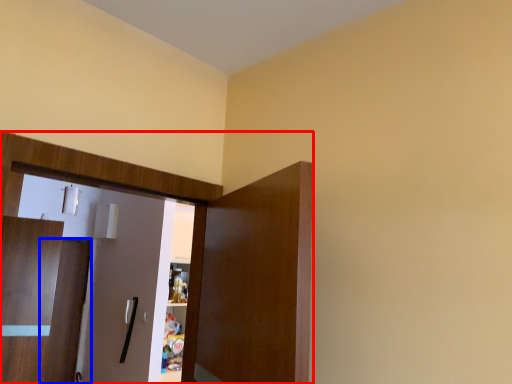
Question: Which of the following is the closest to the observer, dresser (highlighted by a red box) or door (highlighted by a blue box)?

Choices:
 (A) dresser
 (B) door

Answer: (A)